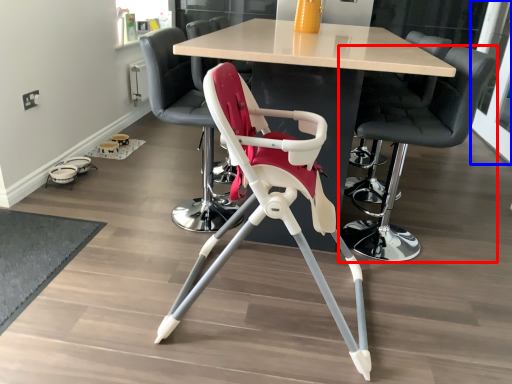
Question: Among these objects, which one is farthest to the camera, chair (highlighted by a red box) or glass door (highlighted by a blue box)?

Choices:
 (A) chair
 (B) glass door

Answer: (B)